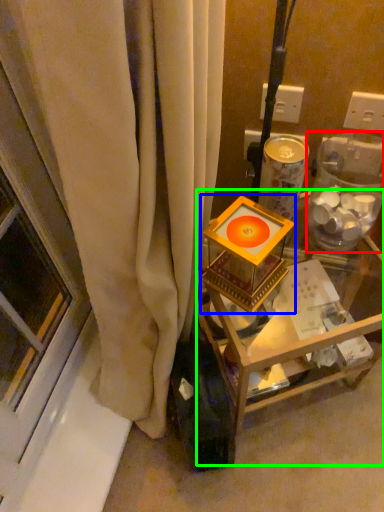
Question: Which object is the farthest from glass box (highlighted by a red box)? Choose among these: candle holder (highlighted by a blue box) or furniture (highlighted by a green box).

Choices:
 (A) candle holder
 (B) furniture

Answer: (B)